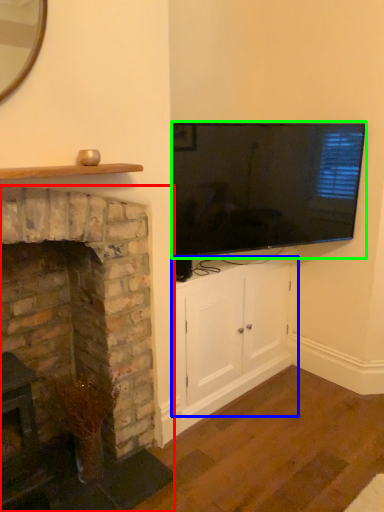
Question: Considering the real-world distances, which object is closest to fireplace (highlighted by a red box)? cabinetry (highlighted by a blue box) or television (highlighted by a green box).

Choices:
 (A) cabinetry
 (B) television

Answer: (A)